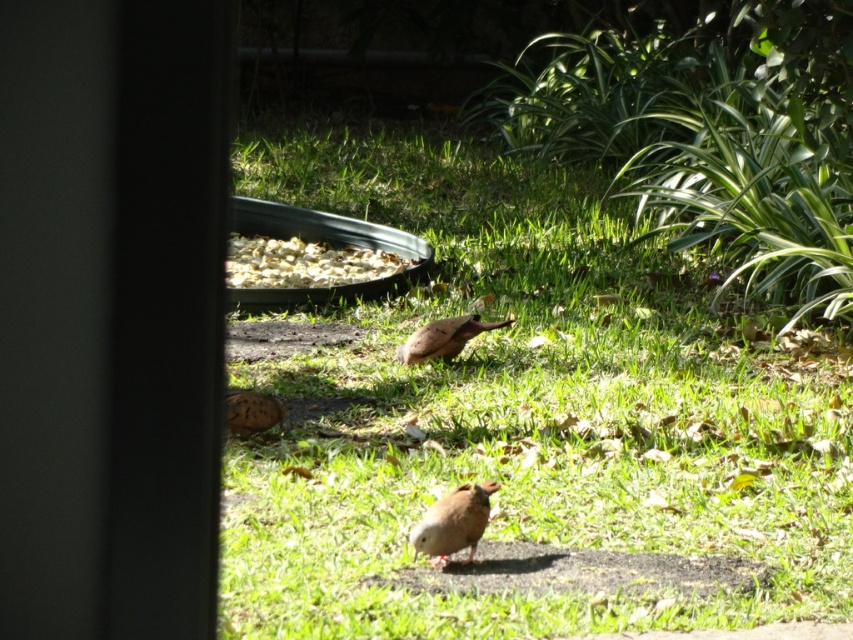
You are a bird feeder maintenance worker who needs to place a new feeder. You see the white crumbly food at center and the brown speckled bird at center. Based on their distance, can the bird reach the food if the feeder can only dispense food up to 15 feet away?

The distance between the white crumbly food at center and the brown speckled bird at center is 13.79 feet, which is within the 15 feet range. Therefore, the bird can reach the food if the feeder is placed appropriately.

You are a photographer trying to capture a closeup of the brown speckled bird at center while standing on the green grass at center. Can you fit both the bird and the grass in the frame without moving your camera?

The green grass at center has a lesser width compared to brown speckled bird at center. Since the grass is narrower, you can fit both the brown speckled bird at center and the green grass at center in the frame without moving the camera.

You are a bird watcher observing the scene. You notice the white crumbly food at center and the brown speckled bird at center. Which object is larger in size?

The white crumbly food at center is bigger than the brown speckled bird at center.